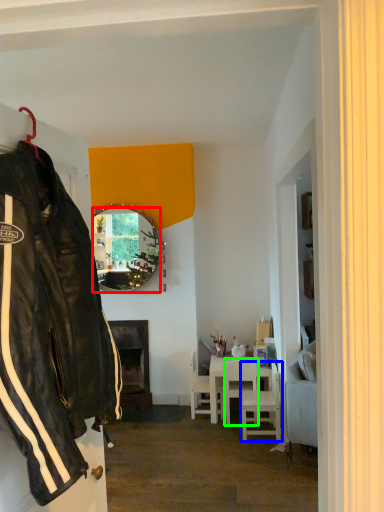
Question: Which is nearer to the mirror (highlighted by a red box)? chair (highlighted by a blue box) or chair (highlighted by a green box).

Choices:
 (A) chair
 (B) chair

Answer: (B)